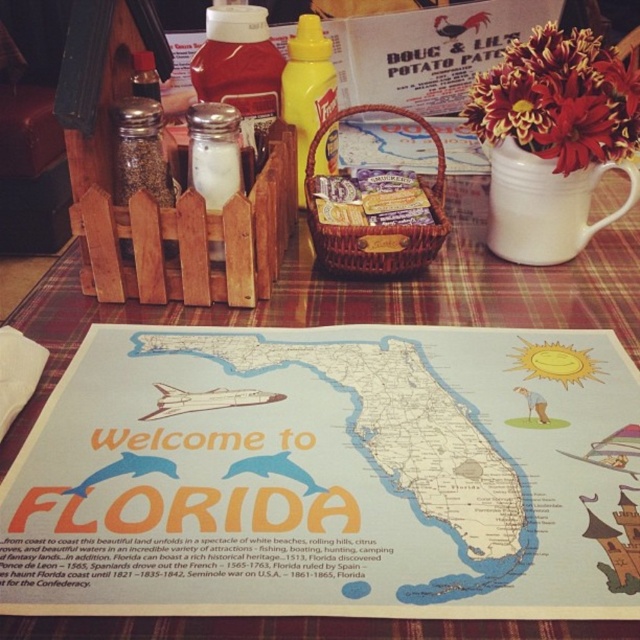
You are a server at the restaurant and need to place a 10cm wide salt shaker on the table. The wooden placemat at center and the yellow matte mustard at center are both in the way. Which object should you move to make space for the salt shaker?

The wooden placemat at center might be wider than yellow matte mustard at center, so you should move the wooden placemat at center to make space for the salt shaker since it occupies more width.

You are a diner sitting at the table and want to place a napkin on the wooden placemat at center. Can you do so without it overlapping the yellow matte mustard at center?

The wooden placemat at center is taller than yellow matte mustard at center, so yes, you can place the napkin on the wooden placemat at center without overlapping the yellow matte mustard at center since the placemat is taller and likely covers more area.